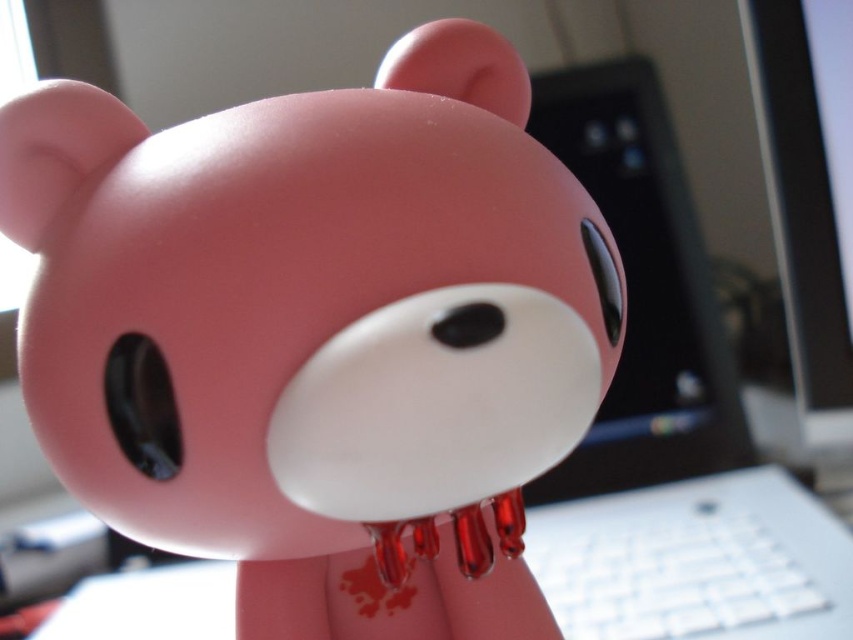
Who is more forward, [91,374] or [613,132]?

Point [91,374] is in front.

Who is taller, matte pink bear at center or sleek black laptop at center?

sleek black laptop at center

You are a GUI agent. You are given a task and a screenshot of the screen. Output one action in this format:
    pyautogui.click(x=<x>, y=<y>)
    Task: Click on the matte pink bear at center
    The image size is (853, 640).
    Given the screenshot: What is the action you would take?
    pyautogui.click(x=318, y=333)

Identify the location of matte pink bear at center. Image resolution: width=853 pixels, height=640 pixels. (318, 333).